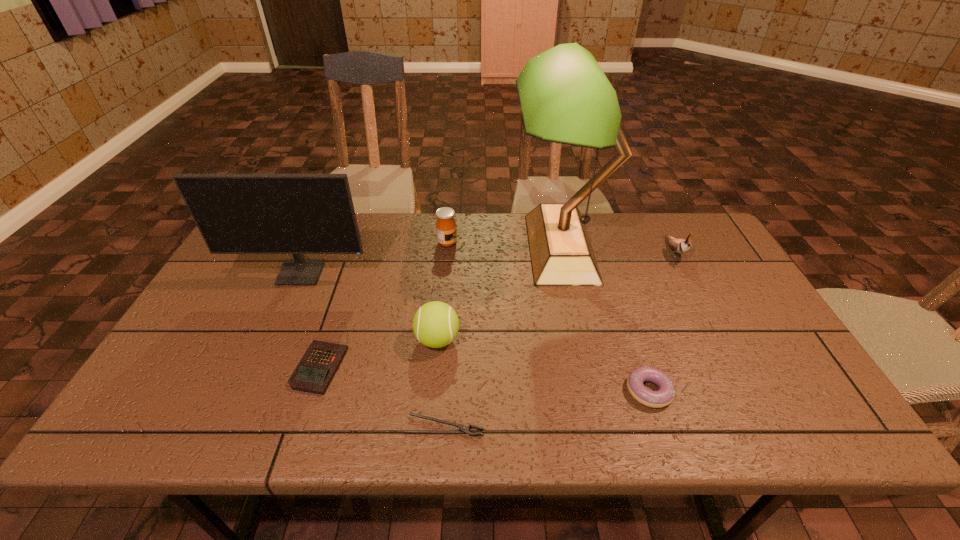
You are a GUI agent. You are given a task and a screenshot of the screen. Output one action in this format:
    pyautogui.click(x=<x>, y=<y>)
    Task: Click on the free point between the tongs and the tallest object
    
    Given the screenshot: What is the action you would take?
    (503, 337)

Find the location of a particular element. This screenshot has width=960, height=540. unoccupied position between the table lamp and the honey is located at coordinates pyautogui.click(x=504, y=245).

Locate an element on the screen. The width and height of the screenshot is (960, 540). object that is the second closest to the tennis ball is located at coordinates tap(316, 369).

Locate which object is the fifth closest to the rightmost object. Please provide its 2D coordinates. Your answer should be formatted as a tuple, i.e. [(x, y)], where the tuple contains the x and y coordinates of a point satisfying the conditions above.

[(463, 429)]

The height and width of the screenshot is (540, 960). I want to click on vacant space that satisfies the following two spatial constraints: 1. on the front-facing side of the honey; 2. on the back side of the nearest object, so click(x=431, y=426).

In order to click on vacant space that satisfies the following two spatial constraints: 1. on the front-facing side of the computer monitor; 2. on the left side of the tongs in this screenshot , I will do `click(232, 426)`.

Image resolution: width=960 pixels, height=540 pixels. In order to click on free spot that satisfies the following two spatial constraints: 1. on the back side of the doughnut; 2. on the metallic stand of the tallest object in this screenshot , I will do `click(602, 248)`.

The image size is (960, 540). I want to click on vacant region that satisfies the following two spatial constraints: 1. on the metallic stand of the sixth tallest object; 2. on the right side of the tallest object, so click(592, 391).